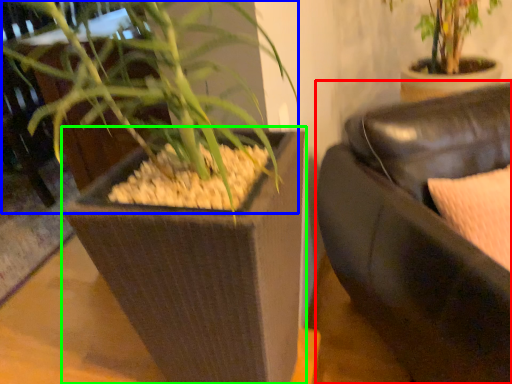
Question: Which is nearer to the studio couch (highlighted by a red box)? orchid (highlighted by a blue box) or flowerpot (highlighted by a green box).

Choices:
 (A) orchid
 (B) flowerpot

Answer: (B)